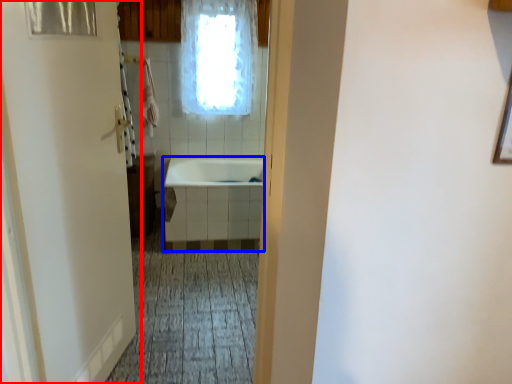
Question: Among these objects, which one is nearest to the camera, door (highlighted by a red box) or bath (highlighted by a blue box)?

Choices:
 (A) door
 (B) bath

Answer: (A)